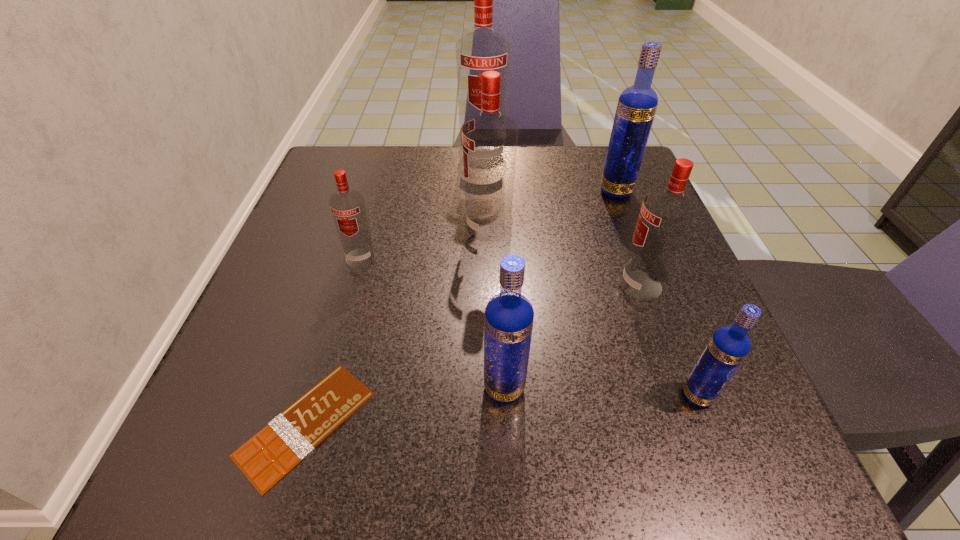
You are a GUI agent. You are given a task and a screenshot of the screen. Output one action in this format:
    pyautogui.click(x=<x>, y=<y>)
    Task: Click on the vacant space at the far edge of the desktop
    
    Given the screenshot: What is the action you would take?
    557,166

This screenshot has height=540, width=960. Find the location of `vacant area at the near edge`. vacant area at the near edge is located at coordinates tap(524, 424).

This screenshot has width=960, height=540. In order to click on vacant area at the left edge in this screenshot , I will do `click(333, 261)`.

Locate an element on the screen. This screenshot has width=960, height=540. vacant space at the right edge is located at coordinates (684, 331).

I want to click on free space at the far left corner of the desktop, so click(x=376, y=166).

You are a GUI agent. You are given a task and a screenshot of the screen. Output one action in this format:
    pyautogui.click(x=<x>, y=<y>)
    Task: Click on the free region at the near right corner of the desktop
    
    Given the screenshot: What is the action you would take?
    pyautogui.click(x=723, y=451)

Locate an element on the screen. The width and height of the screenshot is (960, 540). free space between the sixth nearest vodka and the shortest object is located at coordinates (461, 307).

This screenshot has height=540, width=960. I want to click on vacant area that lies between the third farthest red vodka and the sixth nearest object, so click(x=424, y=244).

Identify the location of free space between the shortest object and the leftmost blue vodka. The image size is (960, 540). (405, 406).

I want to click on unoccupied area between the sixth nearest vodka and the leftmost blue vodka, so click(560, 289).